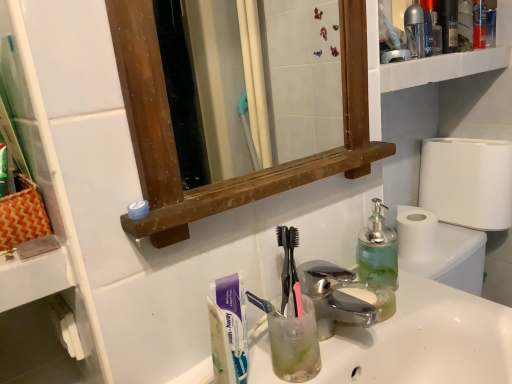
Question: From a real-world perspective, is white paper toilet roll at right over green translucent soap dispenser at right, arranged as the first bottle when viewed from the left?

Choices:
 (A) no
 (B) yes

Answer: (A)

Question: From the image's perspective, would you say white paper toilet roll at right is shown under green translucent soap dispenser at right, the second bottle viewed from the top?

Choices:
 (A) yes
 (B) no

Answer: (B)

Question: Does white paper toilet roll at right lie in front of green translucent soap dispenser at right, the second bottle viewed from the top?

Choices:
 (A) yes
 (B) no

Answer: (B)

Question: Can you confirm if white paper toilet roll at right is positioned to the left of green translucent soap dispenser at right, the second bottle viewed from the top?

Choices:
 (A) no
 (B) yes

Answer: (A)

Question: Is white paper toilet roll at right to the right of green translucent soap dispenser at right, arranged as the first bottle when viewed from the left, from the viewer's perspective?

Choices:
 (A) yes
 (B) no

Answer: (A)

Question: Relative to transparent plastic bottle at upper right, positioned as the 2th bottle in front-to-back order, is orange woven picnic basket at left in front or behind?

Choices:
 (A) behind
 (B) front

Answer: (B)

Question: In terms of width, does orange woven picnic basket at left look wider or thinner when compared to transparent plastic bottle at upper right, placed as the 1th bottle when sorted from top to bottom?

Choices:
 (A) thin
 (B) wide

Answer: (B)

Question: In terms of height, does orange woven picnic basket at left look taller or shorter compared to transparent plastic bottle at upper right, positioned as the 2th bottle in front-to-back order?

Choices:
 (A) tall
 (B) short

Answer: (A)

Question: Visually, is orange woven picnic basket at left positioned to the left or to the right of transparent plastic bottle at upper right, placed as the 1th bottle when sorted from top to bottom?

Choices:
 (A) right
 (B) left

Answer: (B)

Question: From a real-world perspective, is polished chrome faucet at center positioned above or below orange woven picnic basket at left?

Choices:
 (A) below
 (B) above

Answer: (A)

Question: From the image's perspective, is polished chrome faucet at center located above or below orange woven picnic basket at left?

Choices:
 (A) below
 (B) above

Answer: (A)

Question: Based on their sizes in the image, would you say polished chrome faucet at center is bigger or smaller than orange woven picnic basket at left?

Choices:
 (A) big
 (B) small

Answer: (B)

Question: Visually, is polished chrome faucet at center positioned to the left or to the right of orange woven picnic basket at left?

Choices:
 (A) right
 (B) left

Answer: (A)

Question: Is orange woven picnic basket at left taller or shorter than white paper toilet roll at right?

Choices:
 (A) tall
 (B) short

Answer: (B)

Question: Based on their positions, is orange woven picnic basket at left located to the left or right of white paper toilet roll at right?

Choices:
 (A) right
 (B) left

Answer: (B)